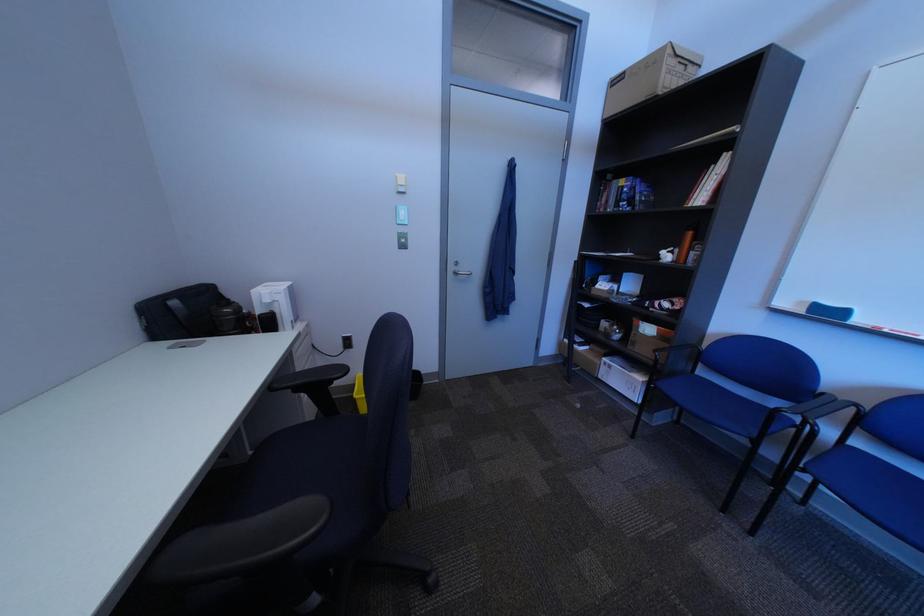
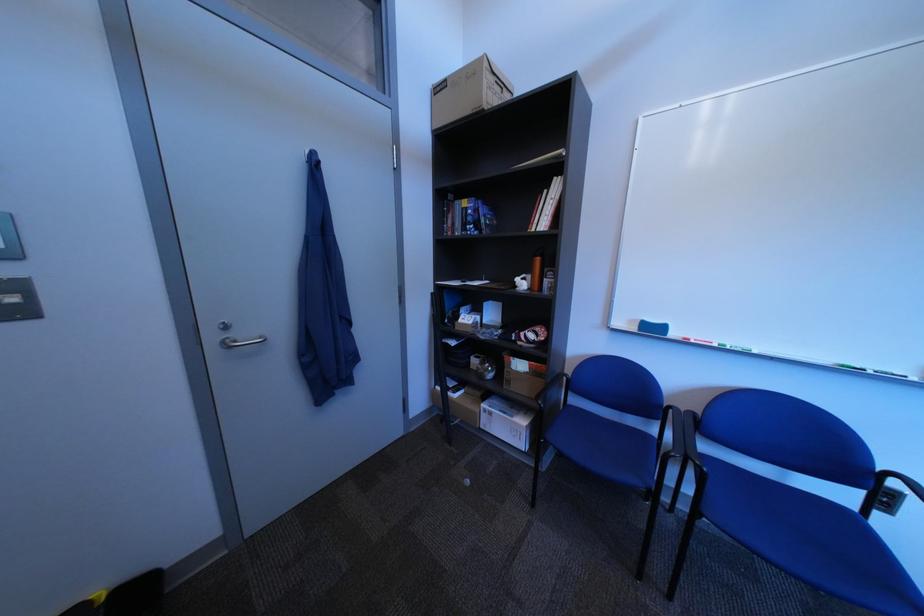
Locate, in the second image, the point that corresponds to (x=467, y=270) in the first image.

(226, 339)